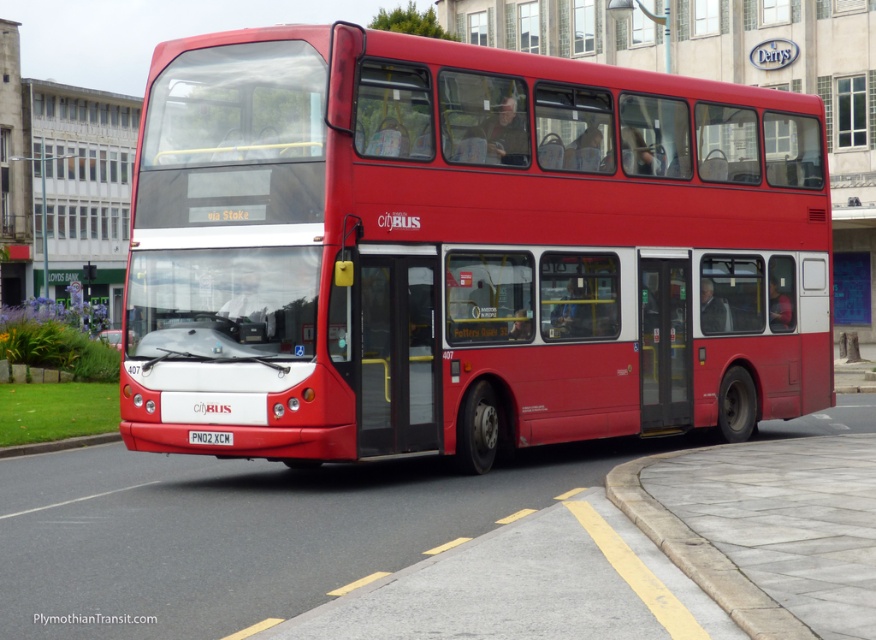
You are standing at the origin point of a coordinate system placed over the image. The origin is at the bottom left corner of the image. The x and y axes increase to the right and upwards respectively. You need to locate the matte red bus at center. What are its coordinates?

The coordinates of the matte red bus at center are at point (463, 250).

From the picture: You are standing at the front of the red double decker bus. You see two points marked on the bus. One is at point [419,93] and the other is at point [224,435]. Which point is closer to the back of the bus?

Point [419,93] is behind point [224,435], so it is closer to the back of the bus.